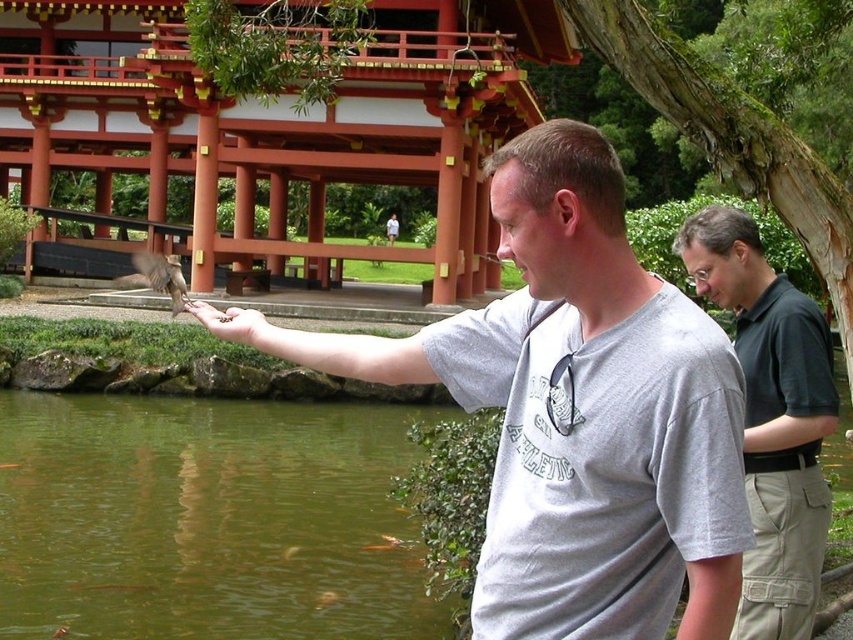
You are standing in the serene outdoor scene near the pond. You see two points marked in the image. Which point, point (595, 157) or point (344, 528), is closer to you?

Point (595, 157) is closer to the viewer than point (344, 528).

You are standing at the edge of the pond and want to pour the green liquid water at lower left onto the dark green polo shirt at right. Considering their positions, will the water reach the shirt?

The green liquid water at lower left is much taller than the dark green polo shirt at right, so pouring the water should reach the shirt easily.